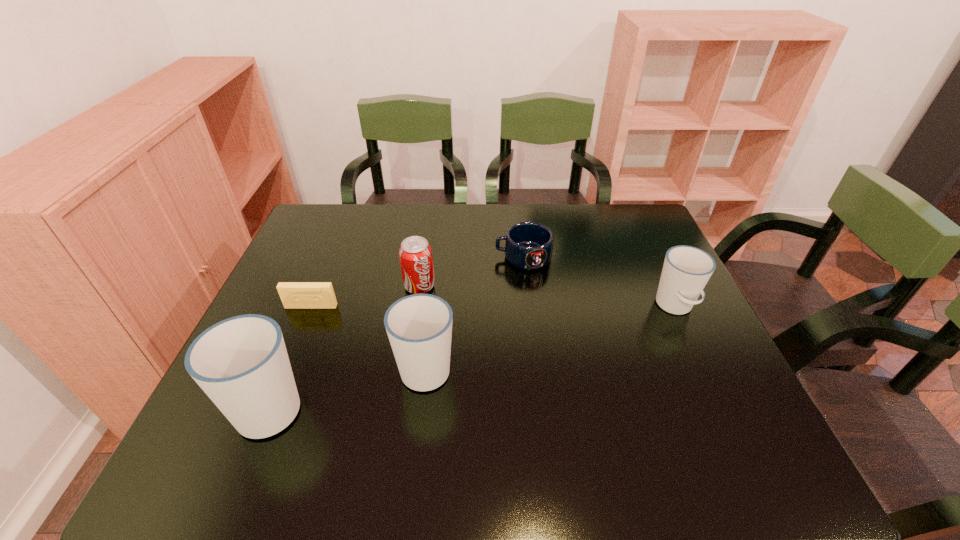
Image resolution: width=960 pixels, height=540 pixels. I want to click on spot to insert another cup for uniform distribution, so coord(559,335).